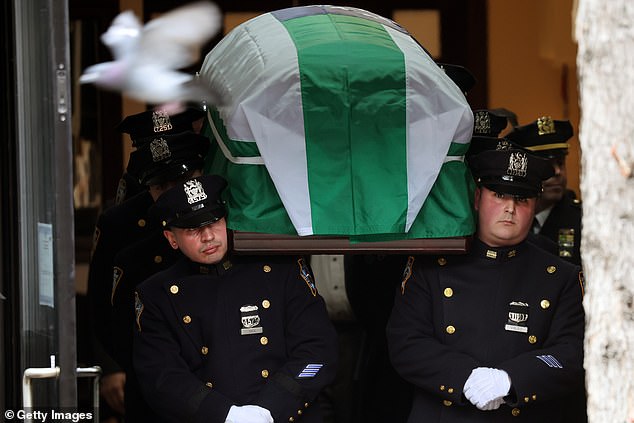
This screenshot has width=634, height=423. What are the coordinates of `door handle` in the screenshot? It's located at (35, 372), (87, 372).